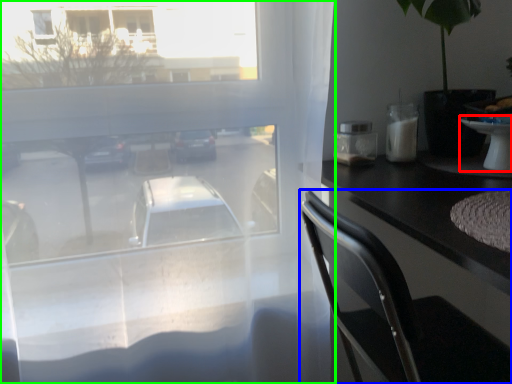
Question: Considering the real-world distances, which object is closest to table (highlighted by a red box)? chair (highlighted by a blue box) or window (highlighted by a green box).

Choices:
 (A) chair
 (B) window

Answer: (A)